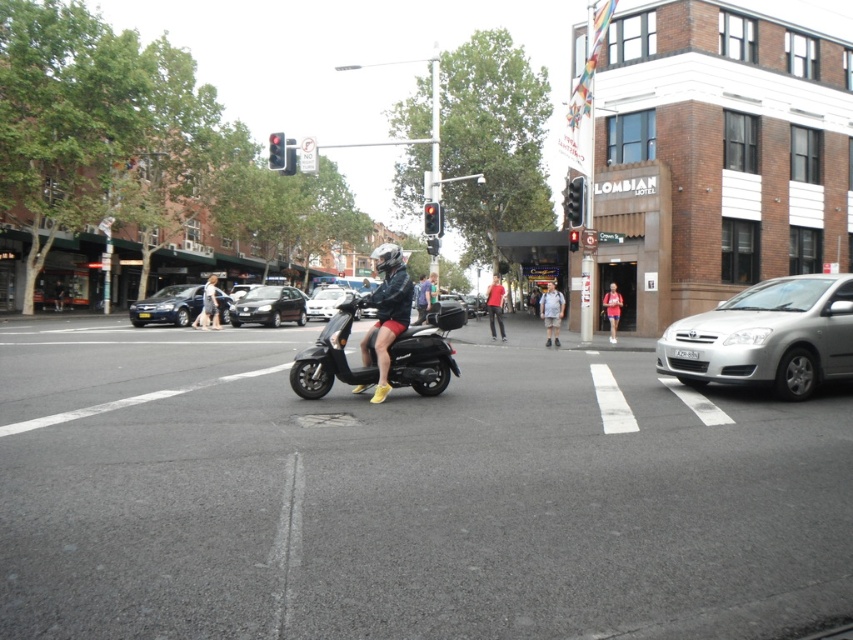
Question: Among these objects, which one is farthest from the camera?

Choices:
 (A) matte black scooter at center
 (B) denim jacket at center
 (C) shiny black scooter at center

Answer: (B)

Question: In this image, where is silver metallic sedan at right located relative to dark gray matte sedan at center?

Choices:
 (A) above
 (B) below

Answer: (B)

Question: Which of the following is the farthest from the observer?

Choices:
 (A) light gray cotton shirt at center
 (B) red cotton shirt at center

Answer: (B)

Question: Estimate the real-world distances between objects in this image. Which object is farther from the black plastic traffic light at upper center?

Choices:
 (A) silver metallic sedan at center
 (B) denim jacket at center
 (C) red glass traffic light at center

Answer: (A)

Question: Can you confirm if silver metallic sedan at center is smaller than red glass traffic light at center?

Choices:
 (A) yes
 (B) no

Answer: (B)

Question: Can you confirm if denim shorts at center is positioned below red glass traffic light at upper center?

Choices:
 (A) yes
 (B) no

Answer: (A)